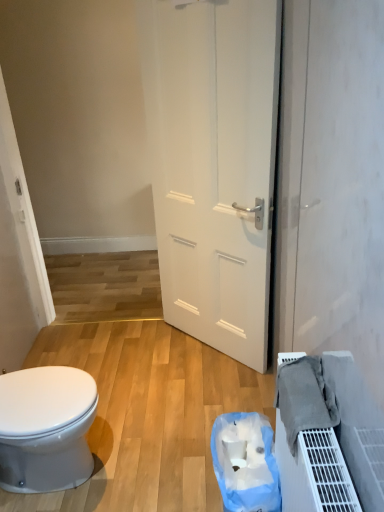
The height and width of the screenshot is (512, 384). Identify the location of vacant space situated on the left part of white matte door at center. (143, 358).